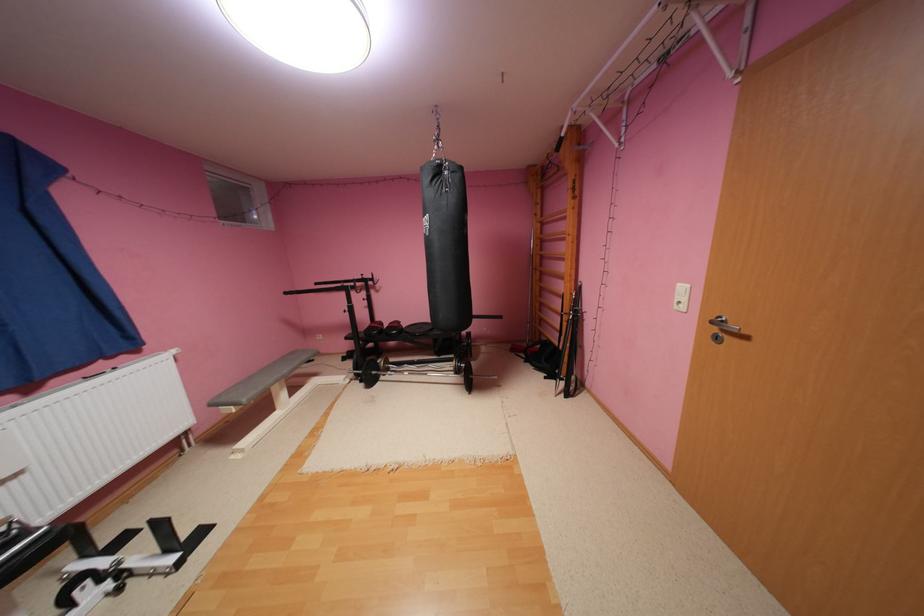
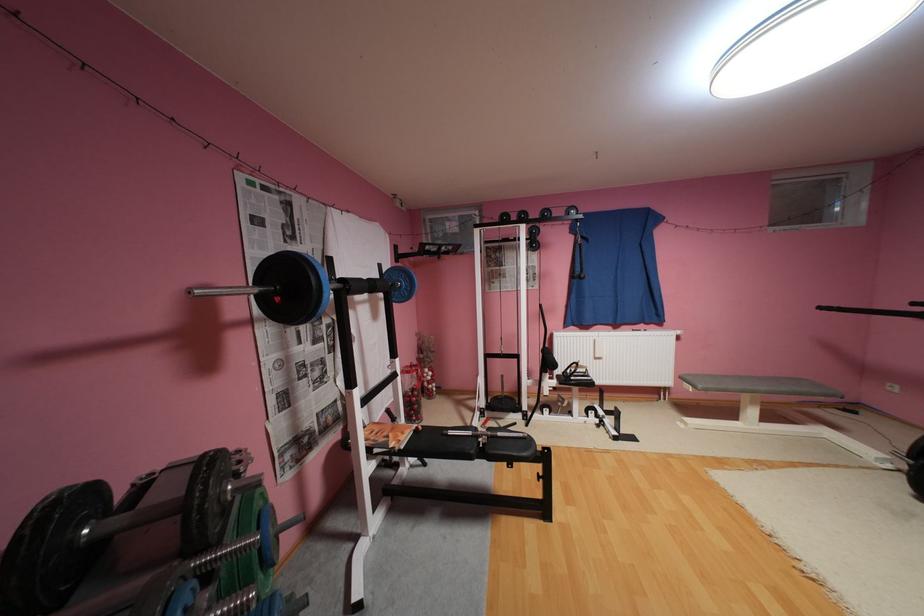
Locate, in the second image, the point that corresponds to (295,371) in the first image.

(771, 387)